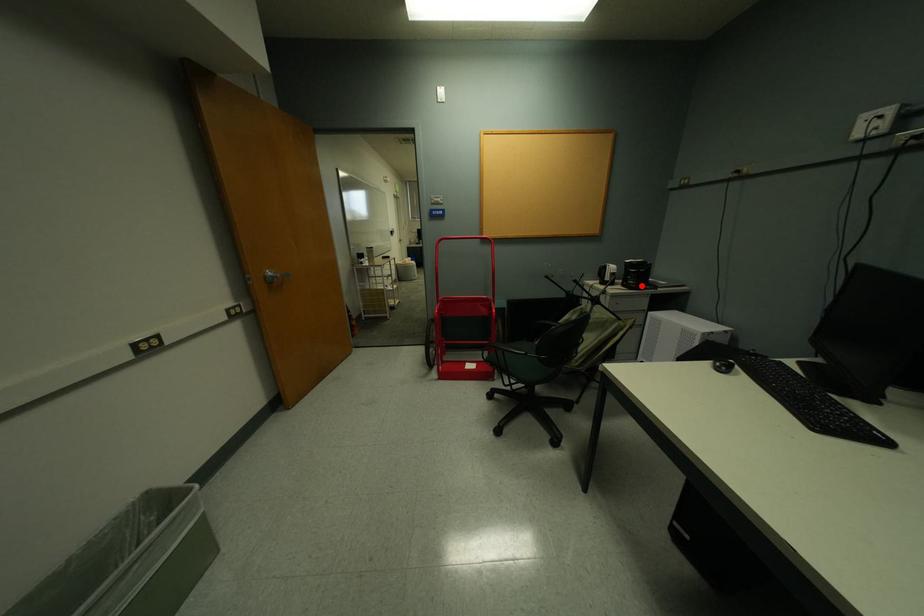
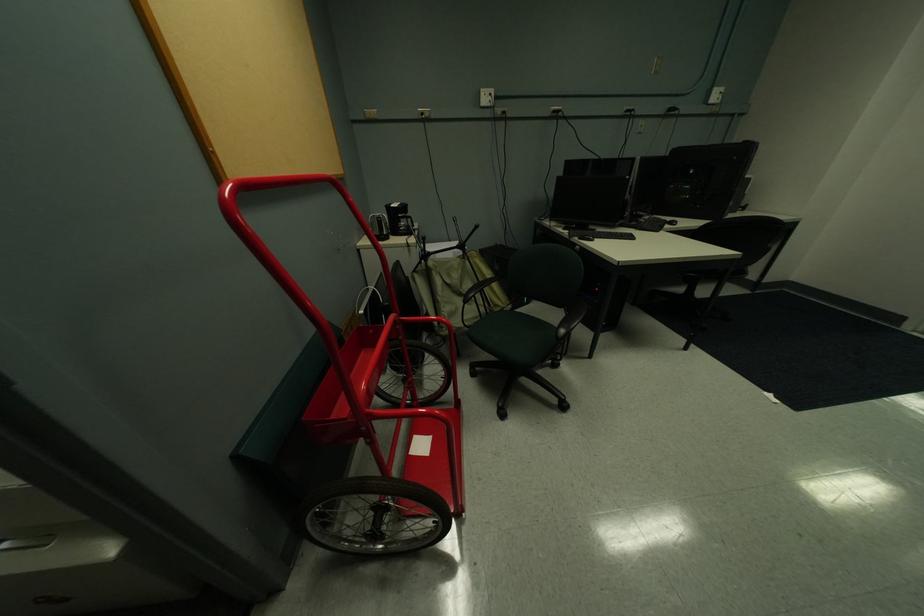
The point at the highlighted location is marked in the first image. Where is the corresponding point in the second image?

(412, 232)